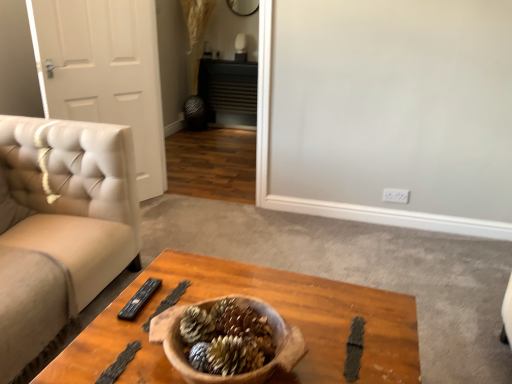
You are a GUI agent. You are given a task and a screenshot of the screen. Output one action in this format:
    pyautogui.click(x=<x>, y=<y>)
    Task: Click on the vacant region to the right of black plastic remote at center
    The height and width of the screenshot is (384, 512).
    Given the screenshot: What is the action you would take?
    point(188,285)